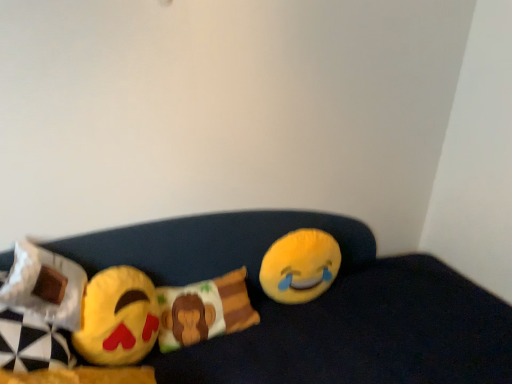
Question: Is yellow plush at right, the 1th toy viewed from the right, taller or shorter than white fabric pillow at left, the first pillow viewed from the left?

Choices:
 (A) short
 (B) tall

Answer: (B)

Question: In the image, is yellow plush at right, which ranks as the first toy in back-to-front order, on the left side or the right side of white fabric pillow at left, acting as the second pillow starting from the back?

Choices:
 (A) right
 (B) left

Answer: (A)

Question: Considering the real-world distances, which object is farthest from the yellow plush at right, positioned as the second toy in left-to-right order?

Choices:
 (A) yellow plush emoji at center
 (B) fluffy cotton pillow with monkey design at center, which ranks as the second pillow in left-to-right order
 (C) matte yellow emoji at left, which appears as the 1th toy when viewed from the front
 (D) white fabric pillow at left, the 1th pillow viewed from the front

Answer: (D)

Question: Considering the real-world distances, which object is closest to the white fabric pillow at left, the first pillow viewed from the left?

Choices:
 (A) matte yellow emoji at left, acting as the 2th toy starting from the back
 (B) fluffy cotton pillow with monkey design at center, which ranks as the second pillow in left-to-right order
 (C) yellow plush emoji at center
 (D) yellow plush at right, the second toy when ordered from front to back

Answer: (A)